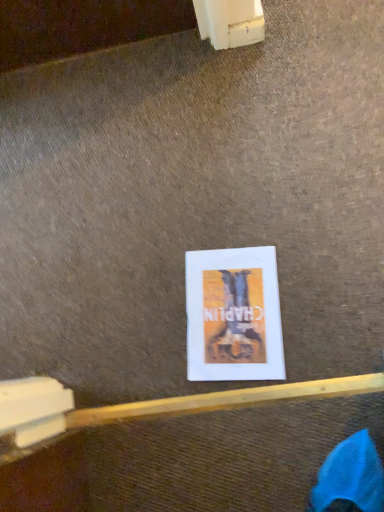
You are a GUI agent. You are given a task and a screenshot of the screen. Output one action in this format:
    pyautogui.click(x=<x>, y=<y>)
    Task: Click on the vacant space situated on the left part of white paper at center
    
    Given the screenshot: What is the action you would take?
    pyautogui.click(x=144, y=348)